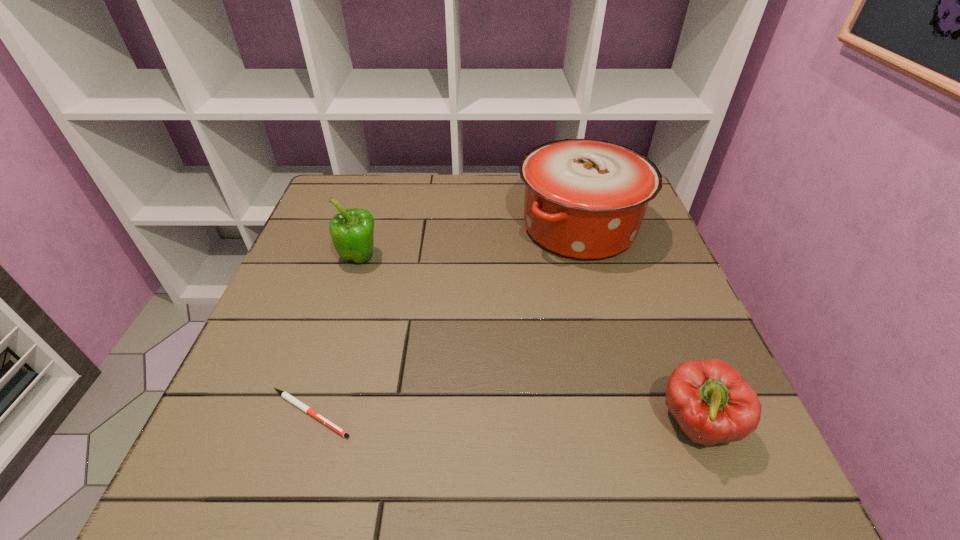
This screenshot has height=540, width=960. In order to click on free region that satisfies the following two spatial constraints: 1. on the clicker of the pen; 2. on the back side of the right bell pepper in this screenshot , I will do `click(307, 424)`.

Locate an element on the screen. vacant space that satisfies the following two spatial constraints: 1. on the clicker of the pen; 2. on the back side of the shorter bell pepper is located at coordinates (307, 424).

Find the location of a particular element. Image resolution: width=960 pixels, height=540 pixels. vacant area that satisfies the following two spatial constraints: 1. on the clicker of the shortest object; 2. on the right side of the third tallest object is located at coordinates (307, 424).